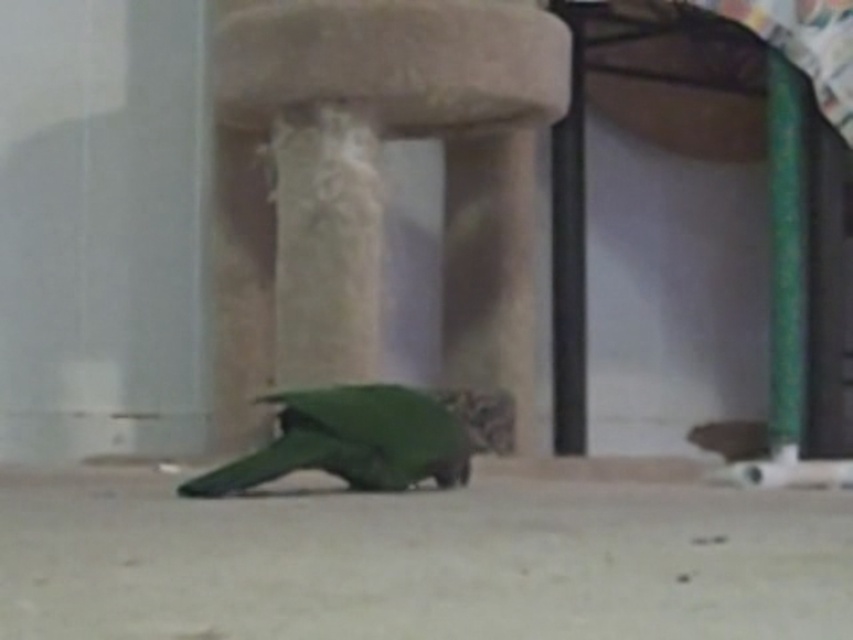
In the scene shown: You are a bird trainer who needs to ensure the green matte parrot at center has enough space to move around. Given that the green plastic pole at right is part of its enclosure, can you confirm if the parrot can comfortably stand upright without touching the pole?

The green matte parrot at center is shorter than the green plastic pole at right, so it can comfortably stand upright without touching the pole.

You are a photographer setting up a shoot in this scene. You have a camera that can only focus on objects at the same height. You need to capture both the beige textured stool at center and the green matte parrot at center in focus. Is this possible?

The beige textured stool at center is above the green matte parrot at center, so they are at different heights. Therefore, the camera cannot focus on both at the same time since they are not at the same height.

You are standing in a room with a beige textured stool at center. You want to place a 3.5 meter long ladder against the wall behind the stool. Is there enough space between you and the stool to place the ladder horizontally without touching it?

The distance between the beige textured stool at center and the viewer is 4.13 meters. Since the ladder is 3.5 meters long, there is sufficient space to place it horizontally without touching the stool.